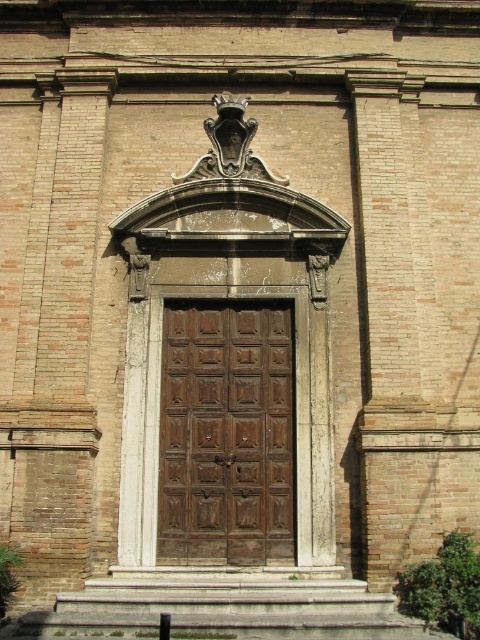
You are a delivery person approaching the entrance of the building. You see the dark brown wood door at center and the smooth stone steps at center. Which object is closer to you as you approach the entrance?

The dark brown wood door at center is closer to you than the smooth stone steps at center as you approach the entrance.

You are a delivery person trying to enter the building through the entrance. The dark brown wood door at center is the main entrance. However, your delivery cart is too wide to fit through the door. Can you use the smooth stone steps at center to go around the door and enter the building?

The dark brown wood door at center is larger in size than smooth stone steps at center, so the door is wider than the steps. Since your cart is too wide for the door, it might also be too wide for the steps. However, the steps are at the center, so they might not provide an alternative entrance path. You should check for another entrance or find a way to reduce the cart width.

You are a delivery person with a cart that is 2 meters wide. You need to move your cart from the street to the dark brown wood door at center. The path between the smooth stone steps at center and the door is 6.95 meters long. Can you safely navigate your cart through this path?

The path between the dark brown wood door at center and smooth stone steps at center is 6.95 meters long. Since the cart is 2 meters wide, the length of the path does not affect the cart width. However, the question is about navigating through the path, which requires sufficient width. The provided information only mentions the distance between the door and steps, not the width of the path. Therefore, it is unclear if the cart can fit. However, since the problem states the path is between the steps and door